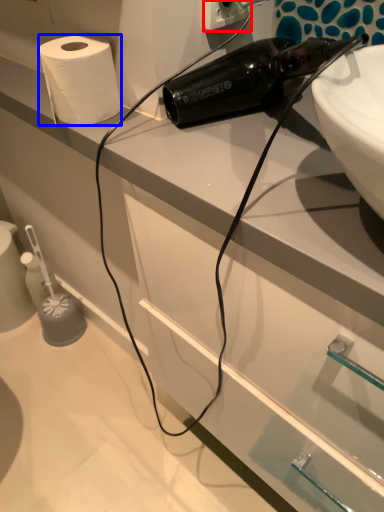
Question: Which object appears closest to the camera in this image, electric outlet (highlighted by a red box) or paper towel (highlighted by a blue box)?

Choices:
 (A) electric outlet
 (B) paper towel

Answer: (A)